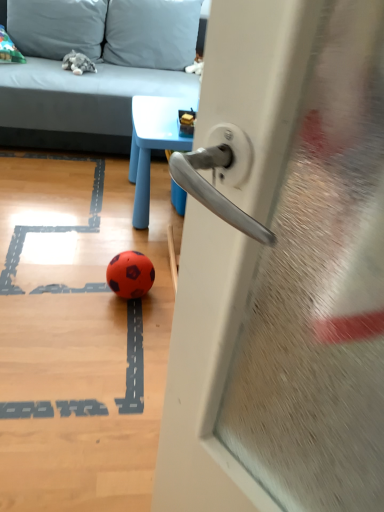
The height and width of the screenshot is (512, 384). I want to click on vacant area on top of blue plastic table at upper center (from a real-world perspective), so click(162, 120).